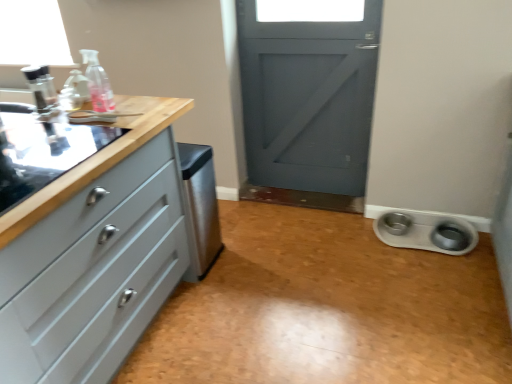
In order to click on free space in front of white plastic pet bowls at lower right in this screenshot , I will do `click(441, 279)`.